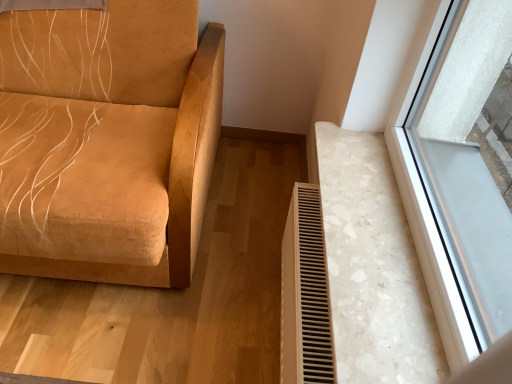
Question: From a real-world perspective, is white textured radiator at lower right located beneath suede-like tan sofa at left?

Choices:
 (A) no
 (B) yes

Answer: (B)

Question: From a real-world perspective, is white textured radiator at lower right physically above suede-like tan sofa at left?

Choices:
 (A) no
 (B) yes

Answer: (A)

Question: From the image's perspective, is white textured radiator at lower right over suede-like tan sofa at left?

Choices:
 (A) no
 (B) yes

Answer: (A)

Question: Is the position of white textured radiator at lower right more distant than that of suede-like tan sofa at left?

Choices:
 (A) yes
 (B) no

Answer: (A)

Question: From the image's perspective, is white textured radiator at lower right beneath suede-like tan sofa at left?

Choices:
 (A) no
 (B) yes

Answer: (B)

Question: Is suede-like tan sofa at left a part of white textured radiator at lower right?

Choices:
 (A) yes
 (B) no

Answer: (B)

Question: Is suede-like tan sofa at left next to white textured radiator at lower right?

Choices:
 (A) no
 (B) yes

Answer: (A)

Question: Is suede-like tan sofa at left thinner than white textured radiator at lower right?

Choices:
 (A) no
 (B) yes

Answer: (A)

Question: Does suede-like tan sofa at left lie in front of white textured radiator at lower right?

Choices:
 (A) no
 (B) yes

Answer: (B)

Question: Is suede-like tan sofa at left surrounding white textured radiator at lower right?

Choices:
 (A) no
 (B) yes

Answer: (A)

Question: Considering the relative sizes of suede-like tan sofa at left and white textured radiator at lower right in the image provided, is suede-like tan sofa at left taller than white textured radiator at lower right?

Choices:
 (A) yes
 (B) no

Answer: (A)

Question: Is suede-like tan sofa at left looking in the opposite direction of white textured radiator at lower right?

Choices:
 (A) no
 (B) yes

Answer: (A)

Question: Based on their sizes in the image, would you say white textured radiator at lower right is bigger or smaller than suede-like tan sofa at left?

Choices:
 (A) big
 (B) small

Answer: (B)